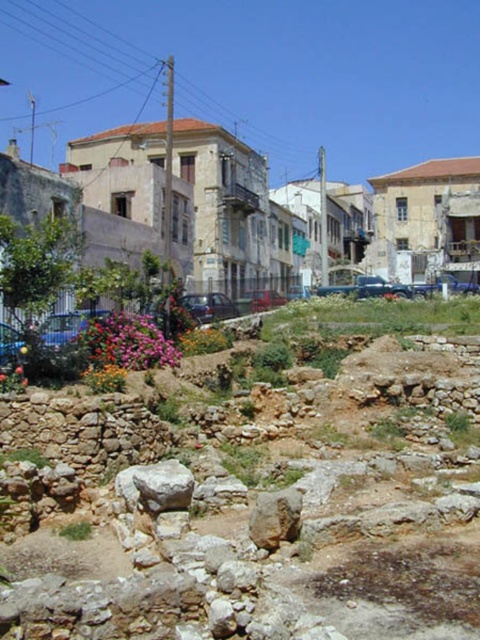
Which is behind, point (285, 483) or point (251, 538)?

Positioned behind is point (285, 483).

Which is more to the left, brown rough stone at lower center or brown rough rock at center?

From the viewer's perspective, brown rough rock at center appears more on the left side.

Identify the location of brown rough stone at lower center. (252, 506).